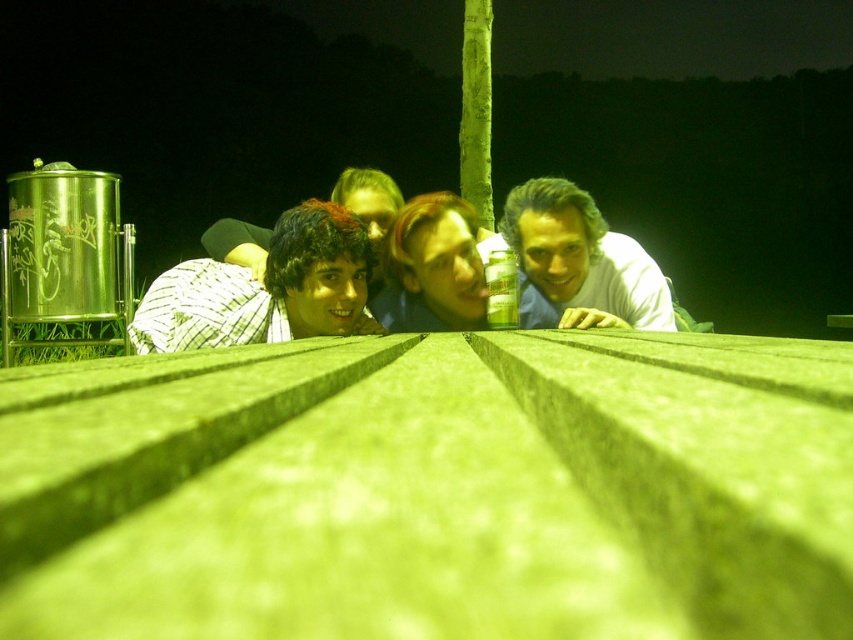
In the scene shown: You are a photographer trying to capture a portrait of the group. You notice two features in the center of the image, the smooth skin face at center and the shiny black hair at center. Which of these two features is positioned lower in the frame?

The smooth skin face at center is positioned lower than the shiny black hair at center in the frame.

You are a photographer trying to capture a portrait of the smooth skin face at center and the shiny black hair at center. Which object should you focus on first if you want to ensure both are in sharp focus?

The smooth skin face at center is positioned on the right side of shiny black hair at center. Since both objects are at the same center position, you should focus on either one as they are at the same distance from the camera.